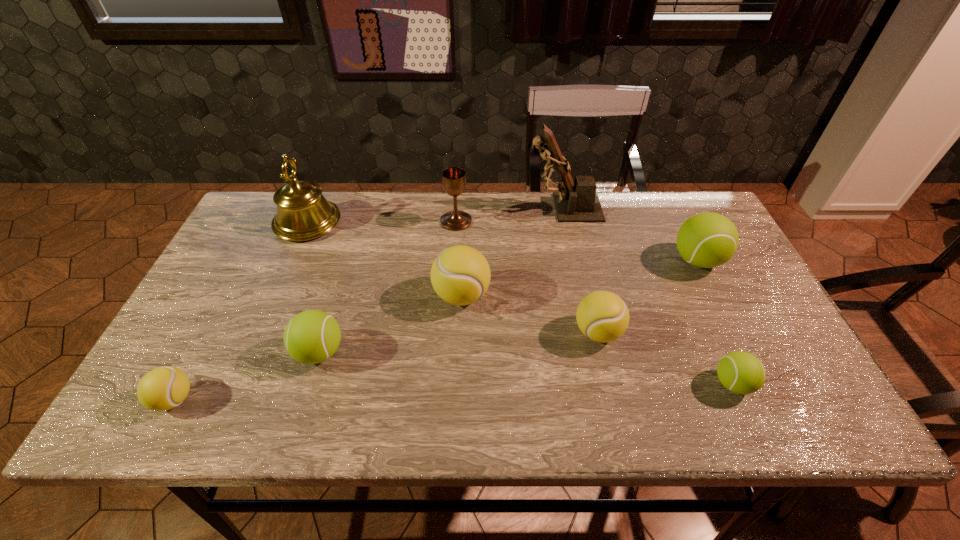
Where is `tennis ball present at the left edge`? tennis ball present at the left edge is located at coordinates (164, 388).

At what (x,y) coordinates should I click in order to perform the action: click on object at the far left corner. Please return your answer as a coordinate pair (x, y). This screenshot has height=540, width=960. Looking at the image, I should click on (303, 213).

The image size is (960, 540). Identify the location of object at the near left corner. (164, 388).

Image resolution: width=960 pixels, height=540 pixels. What are the coordinates of `object that is at the near right corner` in the screenshot? It's located at (740, 372).

Where is `free region at the far edge of the desktop`? free region at the far edge of the desktop is located at coordinates (627, 195).

Identify the location of vacant area at the near edge. point(210,417).

In the image, there is a desktop. Where is `free space at the left edge`? This screenshot has width=960, height=540. free space at the left edge is located at coordinates (237, 285).

In the image, there is a desktop. At what (x,y) coordinates should I click in order to perform the action: click on vacant space at the right edge. Please return your answer as a coordinate pair (x, y). Looking at the image, I should click on (705, 304).

I want to click on free area in between the nearest yellow tennis ball and the smallest green tennis ball, so click(x=453, y=392).

You are a GUI agent. You are given a task and a screenshot of the screen. Output one action in this format:
    pyautogui.click(x=<x>, y=<y>)
    Task: Click on the vacant region between the gold bell and the leftmost tennis ball
    This screenshot has height=540, width=960.
    Given the screenshot: What is the action you would take?
    pyautogui.click(x=241, y=310)